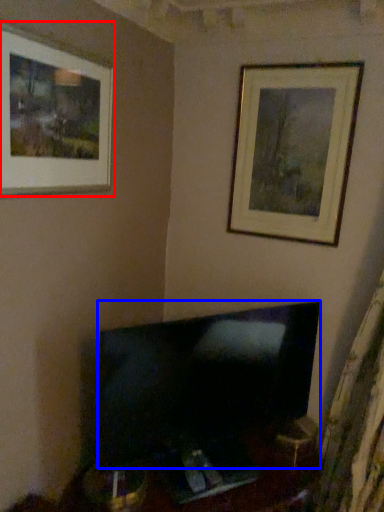
Question: Among these objects, which one is nearest to the camera, picture frame (highlighted by a red box) or television (highlighted by a blue box)?

Choices:
 (A) picture frame
 (B) television

Answer: (A)